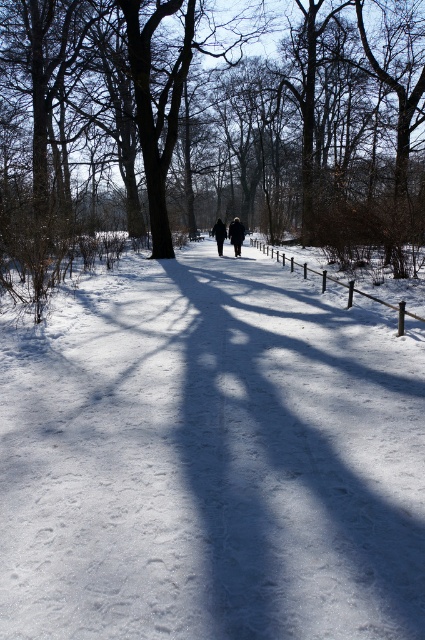
Measure the distance between point (370, 476) and camera.

Point (370, 476) is 14.19 feet away from camera.

Is point (74, 467) positioned after point (220, 228)?

No.

Is point (127, 544) positioned after point (218, 240)?

That is False.

What are the coordinates of `white snow at center` in the screenshot? It's located at (209, 460).

Does brown bark tree at center appear under black fabric at center?

Actually, brown bark tree at center is above black fabric at center.

Does point (325, 3) lie in front of point (214, 228)?

That is False.

Does point (71, 195) come farther from viewer compared to point (221, 237)?

Yes, point (71, 195) is behind point (221, 237).

You are a GUI agent. You are given a task and a screenshot of the screen. Output one action in this format:
    pyautogui.click(x=<x>, y=<y>)
    Task: Click on the brown bark tree at center
    
    Given the screenshot: What is the action you would take?
    click(x=209, y=129)

Is white snow at center bigger than dark blue coat at center?

Correct, white snow at center is larger in size than dark blue coat at center.

Who is shorter, white snow at center or dark blue coat at center?

white snow at center is shorter.

Is point (422, 490) closer to camera compared to point (243, 228)?

That is True.

Image resolution: width=425 pixels, height=640 pixels. I want to click on white snow at center, so click(209, 460).